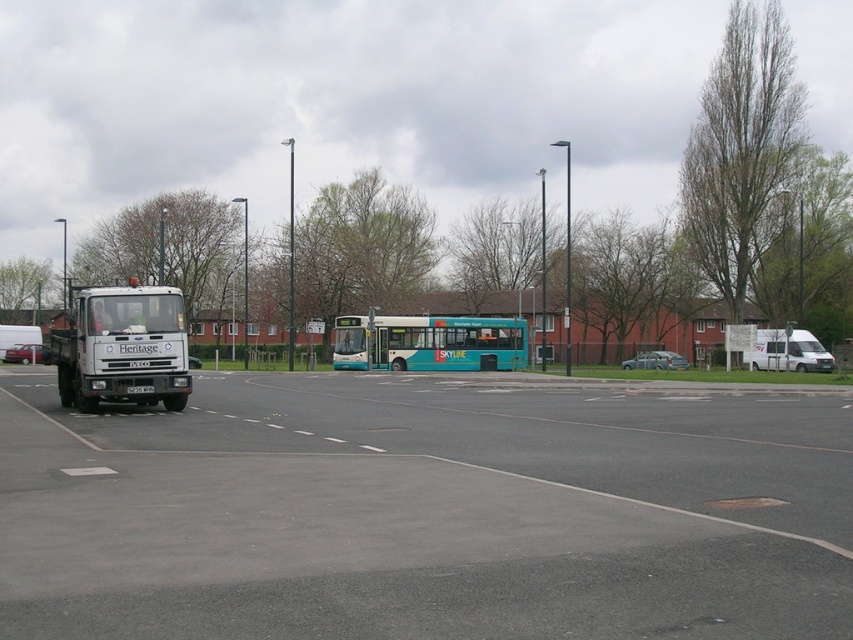
Question: Does gray asphalt parking lot at lower left appear on the right side of white matte van at right?

Choices:
 (A) no
 (B) yes

Answer: (A)

Question: Among these objects, which one is nearest to the camera?

Choices:
 (A) white matte van at right
 (B) gray asphalt parking lot at lower left

Answer: (B)

Question: Is white matte truck at left closer to camera compared to metallic silver car at left?

Choices:
 (A) yes
 (B) no

Answer: (A)

Question: Among these objects, which one is farthest from the camera?

Choices:
 (A) metallic silver car at left
 (B) teal matte bus at center
 (C) white matte truck at left

Answer: (A)

Question: Which object is closer to the camera taking this photo?

Choices:
 (A) metallic silver car at left
 (B) white matte van at right

Answer: (B)

Question: Where is teal matte bus at center located in relation to metallic silver car at left in the image?

Choices:
 (A) right
 (B) left

Answer: (A)